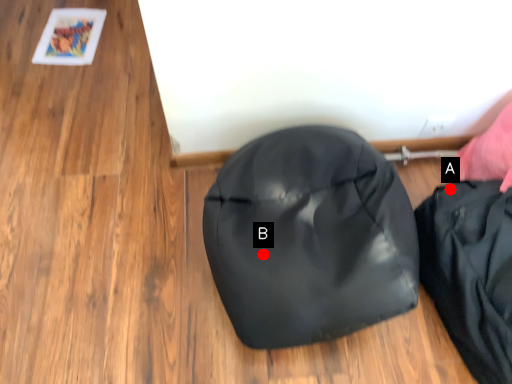
Question: Two points are circled on the image, labeled by A and B beside each circle. Which point is closer to the camera?

Choices:
 (A) A is closer
 (B) B is closer

Answer: (B)